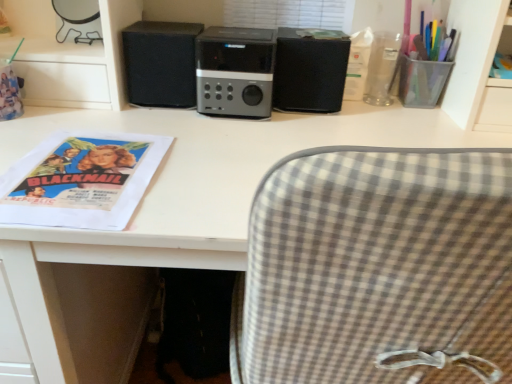
Question: Is clear plastic cup at upper right, acting as the first stationery starting from the left, taller or shorter than matte paper poster at left?

Choices:
 (A) tall
 (B) short

Answer: (A)

Question: Does point (391, 54) appear closer or farther from the camera than point (151, 167)?

Choices:
 (A) closer
 (B) farther

Answer: (B)

Question: Estimate the real-world distances between objects in this image. Which object is farther from the clear plastic cup at upper right, acting as the first stationery starting from the left?

Choices:
 (A) transparent plastic cup at upper right, the 2th stationery when ordered from left to right
 (B) matte paper poster at left
 (C) black matte speaker at center, acting as the second speaker starting from the right
 (D) white matte desk at center
 (E) satin black speaker at center

Answer: (B)

Question: Which is nearer to the matte paper poster at left?

Choices:
 (A) black matte speaker at center, which is the first speaker in right-to-left order
 (B) clear plastic cup at upper right, the second stationery viewed from the right
 (C) black matte speaker at center, the 1th speaker when ordered from left to right
 (D) transparent plastic cup at upper right, the 2th stationery when ordered from left to right
 (E) satin black speaker at center

Answer: (C)